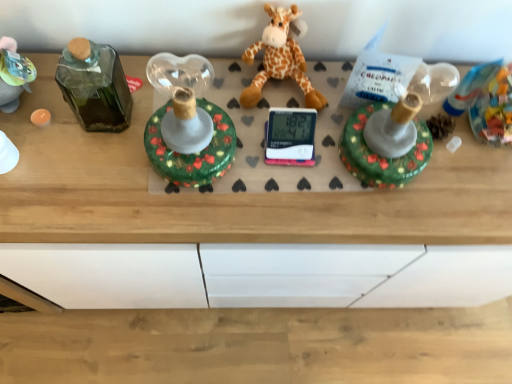
Question: Does soft plush giraffe at center appear on the left side of shiny green glass candlestick at center?

Choices:
 (A) no
 (B) yes

Answer: (A)

Question: Is soft plush giraffe at center beside shiny green glass candlestick at center?

Choices:
 (A) no
 (B) yes

Answer: (A)

Question: Is soft plush giraffe at center facing towards shiny green glass candlestick at center?

Choices:
 (A) yes
 (B) no

Answer: (B)

Question: Is soft plush giraffe at center positioned far away from shiny green glass candlestick at center?

Choices:
 (A) yes
 (B) no

Answer: (B)

Question: From the image's perspective, is soft plush giraffe at center located above shiny green glass candlestick at center?

Choices:
 (A) no
 (B) yes

Answer: (B)

Question: Is shiny green glass candlestick at center completely or partially inside soft plush giraffe at center?

Choices:
 (A) no
 (B) yes

Answer: (A)

Question: Is shiny green glass candlestick at center closer to the viewer compared to soft plush giraffe at center?

Choices:
 (A) yes
 (B) no

Answer: (A)

Question: Does shiny green glass candlestick at center have a smaller size compared to soft plush giraffe at center?

Choices:
 (A) no
 (B) yes

Answer: (A)

Question: From a real-world perspective, is shiny green glass candlestick at center under soft plush giraffe at center?

Choices:
 (A) yes
 (B) no

Answer: (B)

Question: From a real-world perspective, is shiny green glass candlestick at center on soft plush giraffe at center?

Choices:
 (A) yes
 (B) no

Answer: (A)

Question: Are shiny green glass candlestick at center and soft plush giraffe at center beside each other?

Choices:
 (A) no
 (B) yes

Answer: (A)

Question: Is shiny green glass candlestick at center oriented towards soft plush giraffe at center?

Choices:
 (A) yes
 (B) no

Answer: (B)

Question: Is shiny green glass candlestick at center situated inside soft plush giraffe at center or outside?

Choices:
 (A) inside
 (B) outside

Answer: (B)